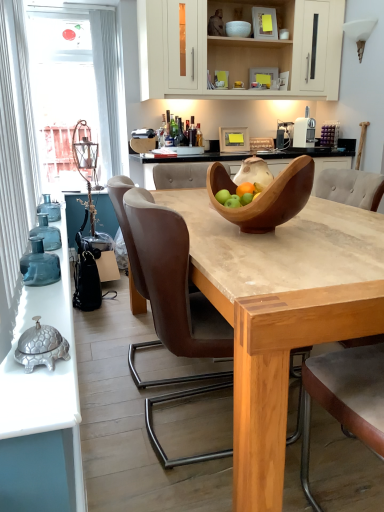
In order to click on free space to the right of wooden bowl at center, which is the 2th bowl from back to front in this screenshot , I will do `click(353, 229)`.